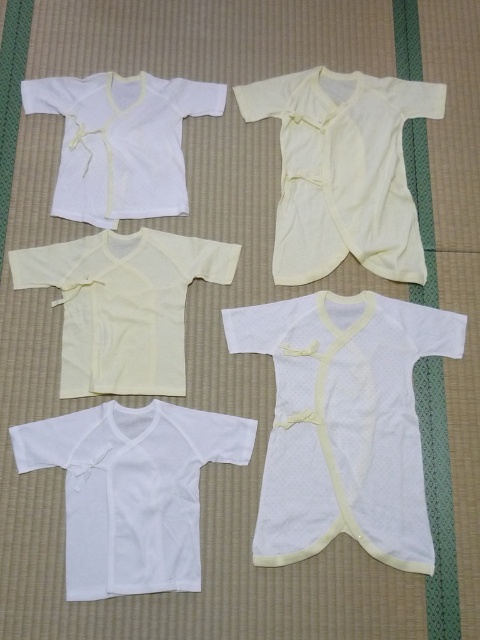
You are a parent trying to organize baby clothes on a tatami mat. You have a white soft fabric baby gown at center. Where exactly should you place it to match the existing arrangement?

The white soft fabric baby gown at center should be placed at point (344, 422) to align with the existing arrangement on the tatami mat.

You are organizing baby clothes on a tatami mat. You have a yellow soft cotton shirt at center and a white cotton shirt at upper left. Which shirt is positioned to the left of the other?

The yellow soft cotton shirt at center is to the left of the white cotton shirt at upper left.

You are organizing baby clothes on a tatami mat and need to place a new item between the yellow soft cotton shirt at center and the white cotton shirt at upper left. Based on their positions, where should you place the new item?

The yellow soft cotton shirt at center is below the white cotton shirt at upper left, so placing the new item between them would require positioning it above the yellow soft cotton shirt at center and below the white cotton shirt at upper left.